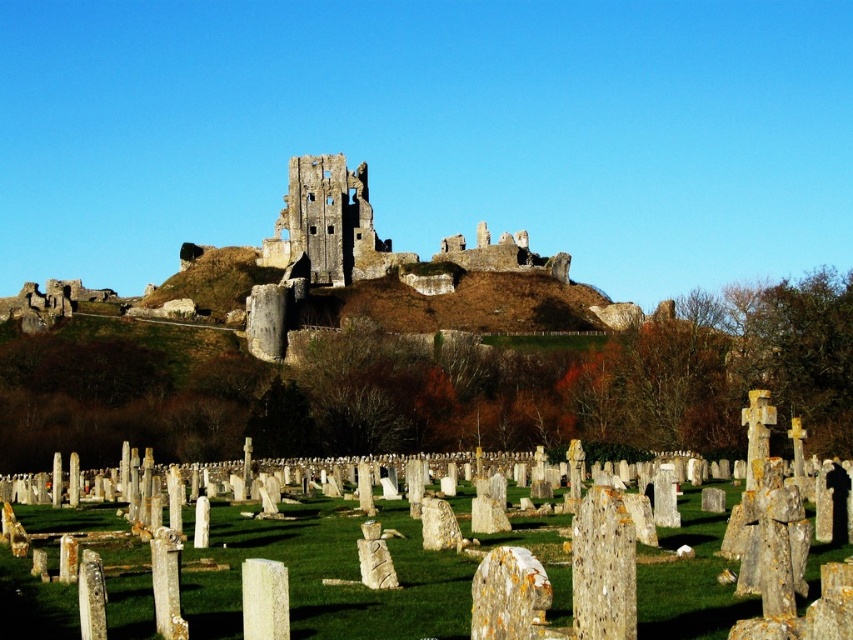
Question: Which point is farther to the camera?

Choices:
 (A) 339,221
 (B) 572,557

Answer: (A)

Question: Which point is closer to the camera?

Choices:
 (A) (363, 186)
 (B) (56, 592)

Answer: (B)

Question: Does speckled stone gravestones at center lie behind rustic stone castle at center?

Choices:
 (A) no
 (B) yes

Answer: (A)

Question: Is speckled stone gravestones at center smaller than rustic stone castle at center?

Choices:
 (A) yes
 (B) no

Answer: (B)

Question: Where is speckled stone gravestones at center located in relation to rustic stone castle at center in the image?

Choices:
 (A) below
 (B) above

Answer: (A)